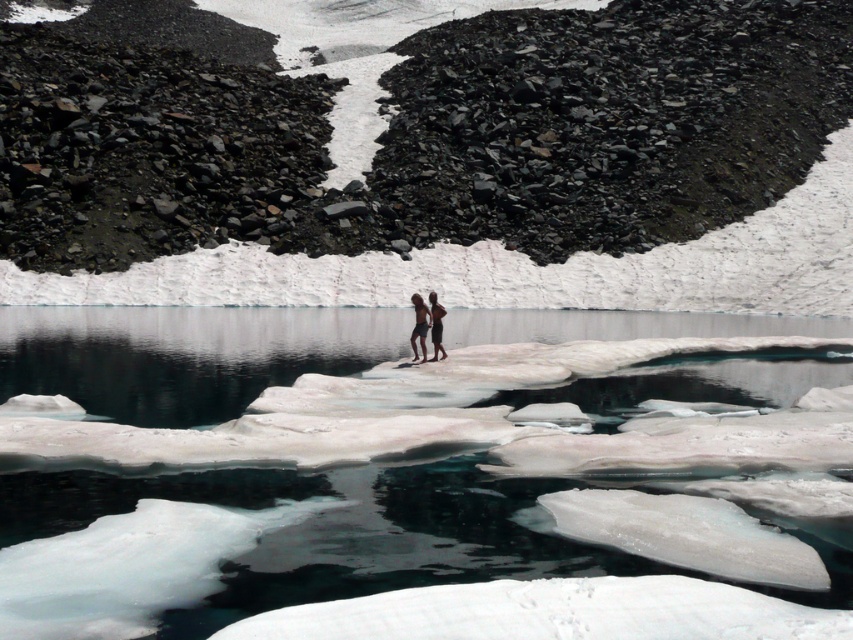
What is the color of the object located at the coordinates point (419, 324) in the image?

The point (419, 324) corresponds to tan skin at center.

You are a hiker standing on the ice floe with the two individuals. You notice the clear ice at center and tan skin at center. Which object is positioned lower in the scene?

The clear ice at center is located below tan skin at center, so the clear ice at center is positioned lower in the scene.

From the picture: You are a photographer planning to take a photo of the clear ice at center and the tan skin at center in the glacial lake scene. Based on their positions, which object will appear closer to the camera in the final photo?

The clear ice at center will appear closer to the camera in the final photo because it is positioned in front of the tan skin at center.